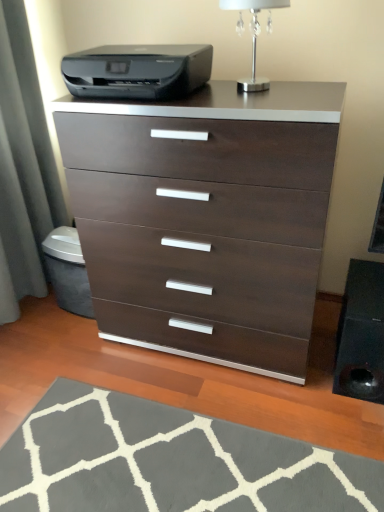
Image resolution: width=384 pixels, height=512 pixels. Find the location of `free point above gray soft rug at lower center (from a real-world perspective)`. free point above gray soft rug at lower center (from a real-world perspective) is located at coordinates (138, 458).